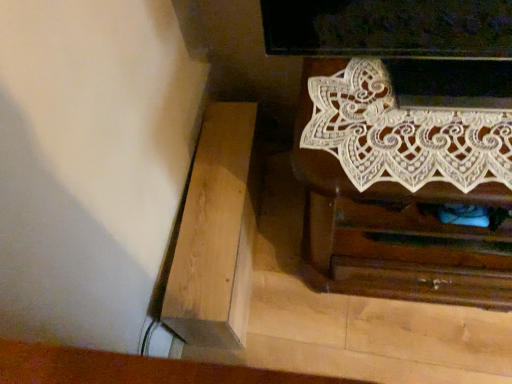
Locate an element on the screen. This screenshot has width=512, height=384. vacant point above light brown wood at lower left (from a real-world perspective) is located at coordinates (211, 203).